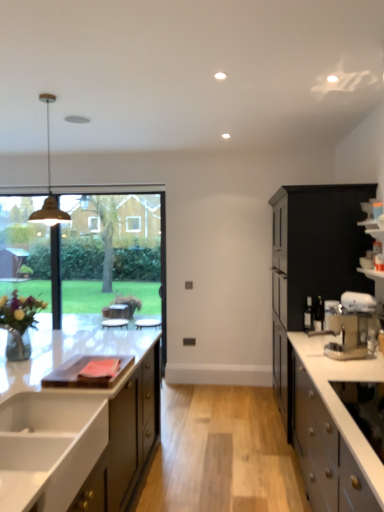
Question: Does point (362, 463) appear closer or farther from the camera than point (19, 220)?

Choices:
 (A) closer
 (B) farther

Answer: (A)

Question: Considering the positions of white matte cabinet at right, which is counted as the second cabinetry, starting from the right, and transparent glass window at center, acting as the second window screen starting from the left, in the image, is white matte cabinet at right, which is counted as the second cabinetry, starting from the right, wider or thinner than transparent glass window at center, acting as the second window screen starting from the left,?

Choices:
 (A) wide
 (B) thin

Answer: (A)

Question: Considering the real-world distances, which object is closest to the matte white cabinetry at left, positioned as the third cabinetry in right-to-left order?

Choices:
 (A) white glossy sink at lower left
 (B) white matte cabinet at right, which is counted as the second cabinetry, starting from the right
 (C) matte black cabinet at right, the 1th cabinetry in the right-to-left sequence
 (D) transparent glass window at center, acting as the 1th window screen starting from the right
 (E) translucent glass window screen at left, the 2th window screen when ordered from right to left

Answer: (A)

Question: Considering the real-world distances, which object is closest to the matte white cabinetry at left, positioned as the third cabinetry in right-to-left order?

Choices:
 (A) matte brass pendant light at upper left
 (B) white matte cabinet at right, which is counted as the second cabinetry, starting from the right
 (C) transparent glass window at center, acting as the second window screen starting from the left
 (D) metallic silver coffee machine at right
 (E) white glossy sink at lower left

Answer: (E)